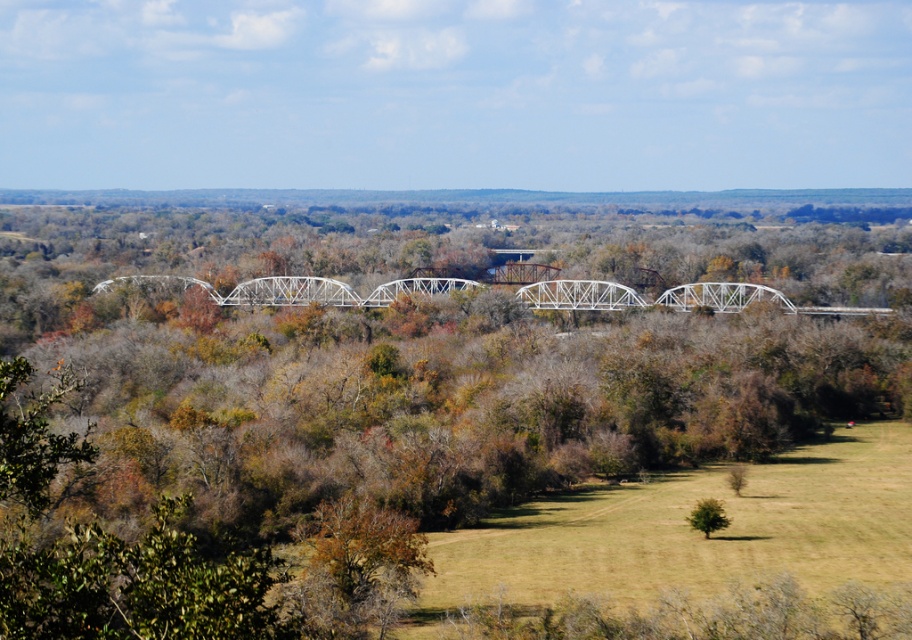
Question: Which is nearer to the white metallic bridge at center?

Choices:
 (A) green grassy field at lower right
 (B) green leafy tree at center
 (C) green matte tree at center

Answer: (B)

Question: Which is farther from the green matte tree at center?

Choices:
 (A) green leafy tree at center
 (B) white metallic bridge at center
 (C) green grassy field at lower right

Answer: (B)

Question: Based on their relative distances, which object is nearer to the white metallic bridge at center?

Choices:
 (A) green matte tree at center
 (B) green leafy tree at center

Answer: (B)

Question: Observing the image, what is the correct spatial positioning of green leafy tree at center in reference to green grassy field at lower right?

Choices:
 (A) below
 (B) above

Answer: (B)

Question: Can you confirm if green leafy tree at center is thinner than green grassy field at lower right?

Choices:
 (A) yes
 (B) no

Answer: (B)

Question: Does green grassy field at lower right have a larger size compared to green matte tree at center?

Choices:
 (A) no
 (B) yes

Answer: (B)